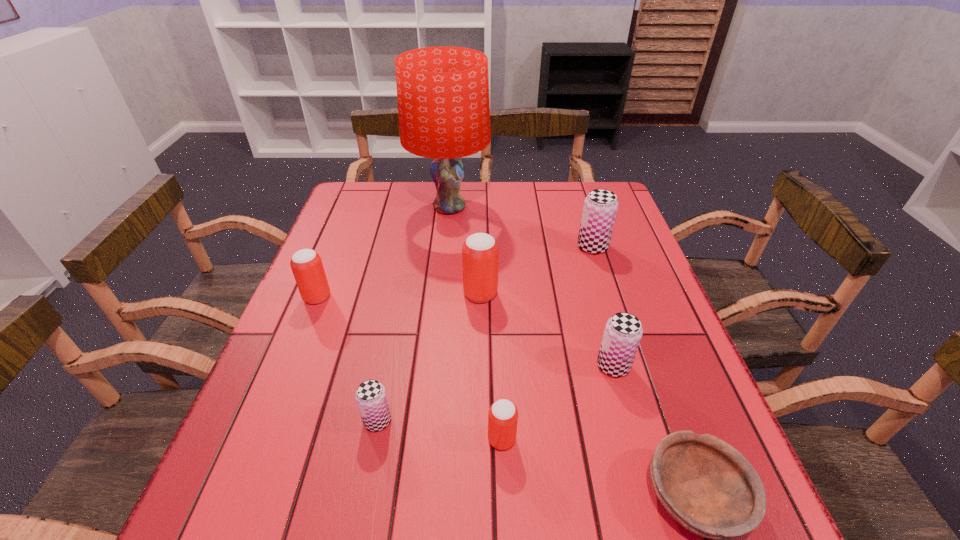
Point out which red beer can is positioned as the nearest to the biggest red beer can. Please provide its 2D coordinates. Your answer should be formatted as a tuple, i.e. [(x, y)], where the tuple contains the x and y coordinates of a point satisfying the conditions above.

[(503, 415)]

Choose which red beer can is the second nearest neighbor to the smallest red beer can. Please provide its 2D coordinates. Your answer should be formatted as a tuple, i.e. [(x, y)], where the tuple contains the x and y coordinates of a point satisfying the conditions above.

[(306, 264)]

The image size is (960, 540). In order to click on vacant space that satisfies the following two spatial constraints: 1. on the front-facing side of the fourth nearest object; 2. on the left side of the farthest object in this screenshot , I will do `click(434, 366)`.

The image size is (960, 540). Identify the location of vacant point that satisfies the following two spatial constraints: 1. on the front-facing side of the second farthest purple beer can; 2. on the right side of the farthest object. (434, 366).